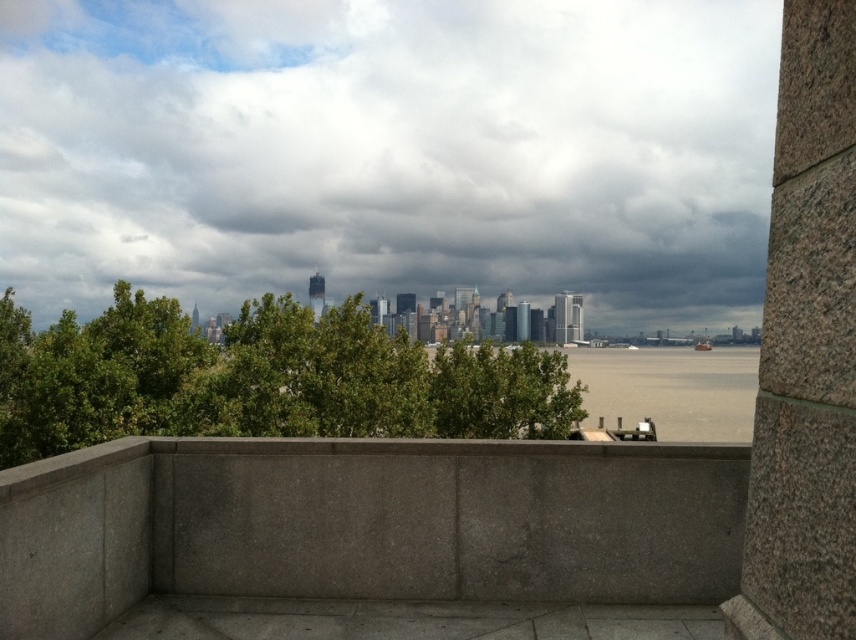
You are standing on the viewing platform and want to know which area takes up more space in the image between the gray concrete ledge at center and the gray water at lower center. Based on the scene, which one is larger?

The gray water at lower center occupies more space than the gray concrete ledge at center, so the gray water at lower center is larger.

You are an architect designing a new observation deck. You want to ensure that the cloudy sky at upper center remains the focal point compared to the gray concrete ledge at center. Based on the scene, what existing feature might help achieve this?

The cloudy sky at upper center is larger in size than the gray concrete ledge at center, which naturally draws more attention to the sky, making it the focal point.

You are standing on the gray concrete ledge at center and looking towards the cloudy sky at upper center. Which object is closer to your eyes?

The gray concrete ledge at center is closer to your eyes than the cloudy sky at upper center because the cloudy sky at upper center is further to the viewer.